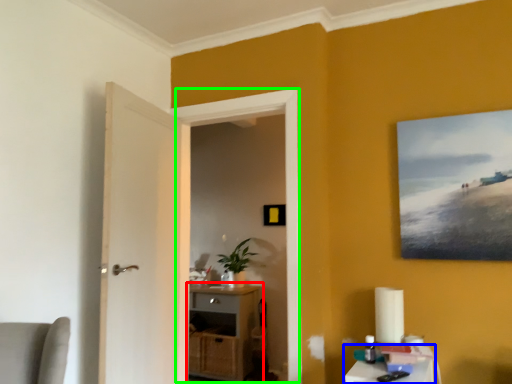
Question: Which object is positioned farthest from cabinetry (highlighted by a red box)? Select from table (highlighted by a blue box) and window (highlighted by a green box).

Choices:
 (A) table
 (B) window

Answer: (A)